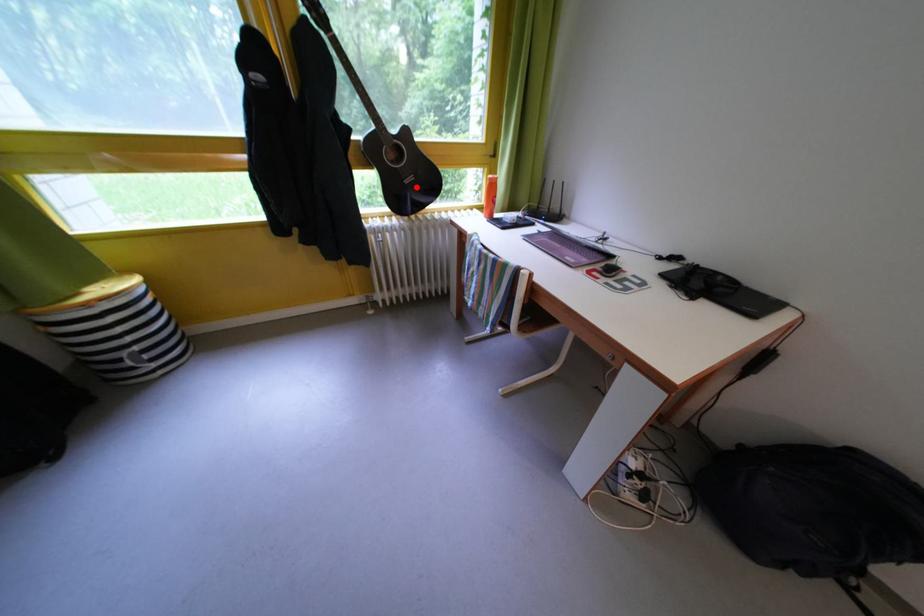
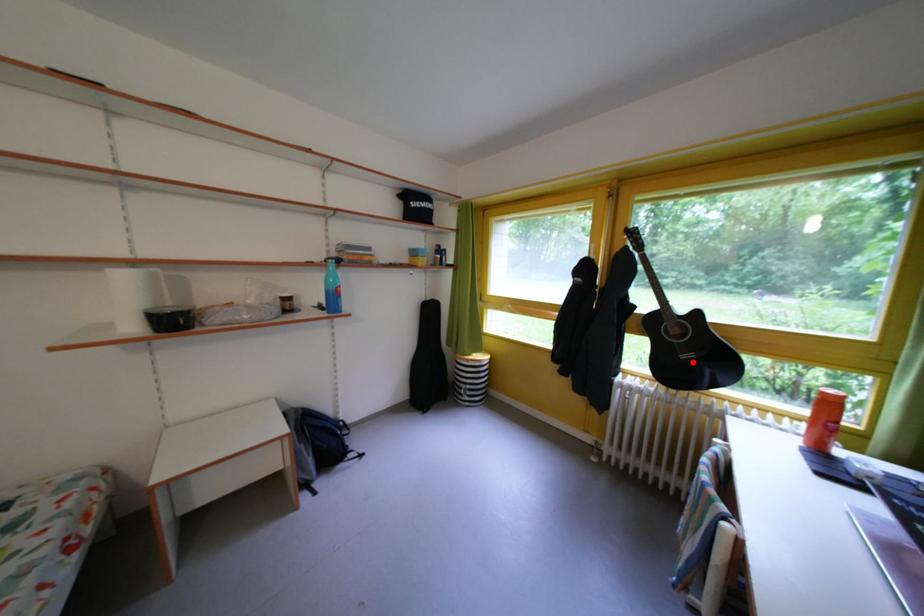
I am providing you with two images of the same scene from different viewpoints. A red point is marked on the first image and another point is marked on the second image. Does the point marked in image1 correspond to the same location as the one in image2?

Yes